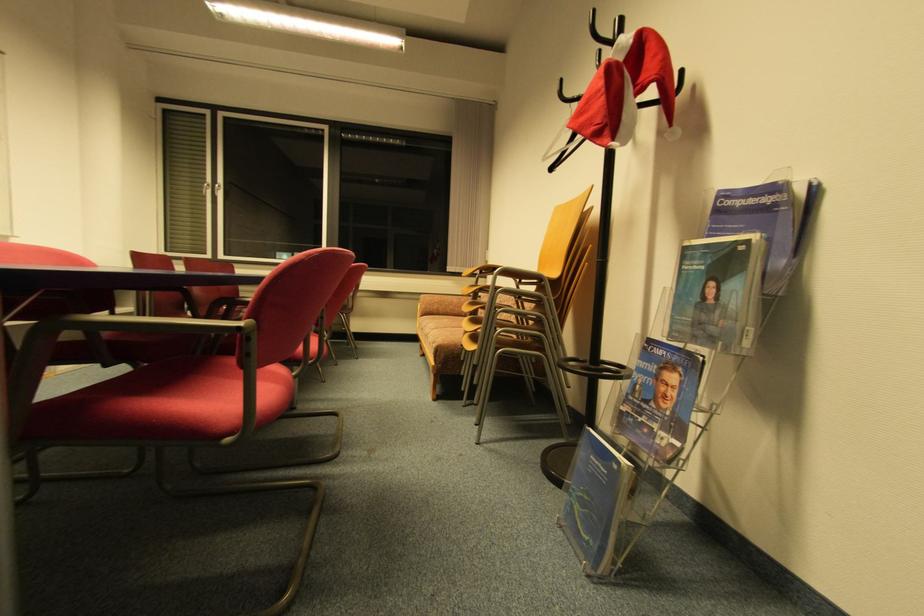
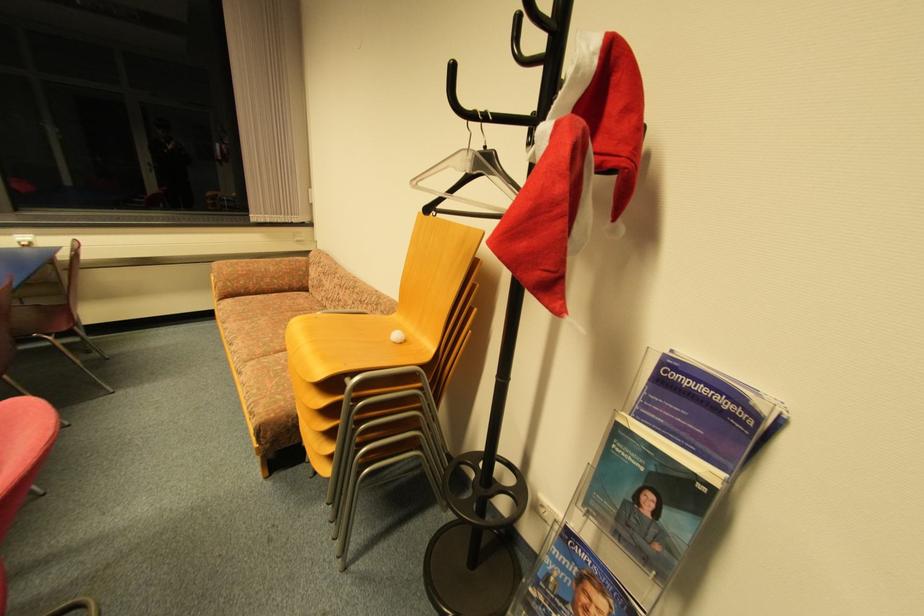
In the second image, find the point that corresponds to the point at 664,353 in the first image.

(588, 557)